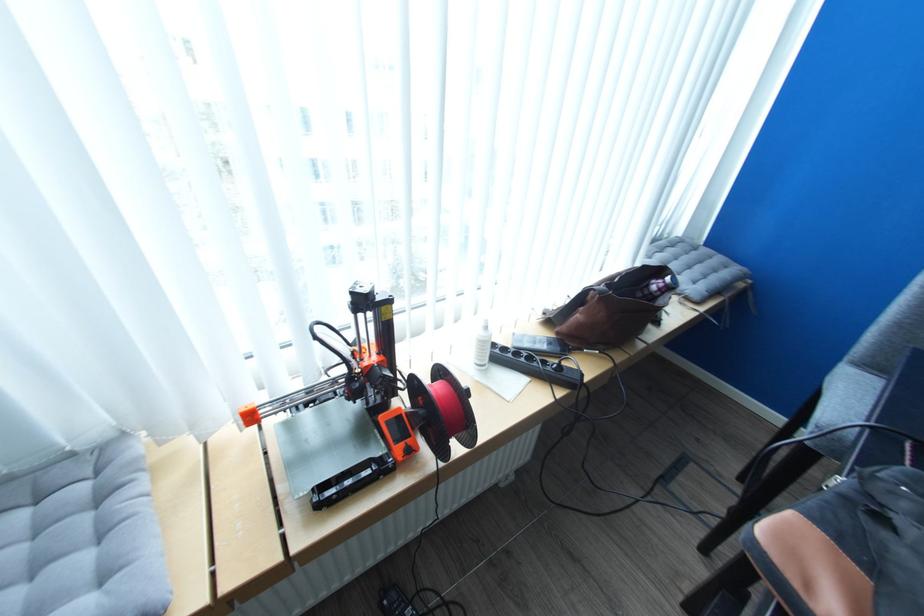
Where is `printer control knob`? The image size is (924, 616). printer control knob is located at coordinates (419, 517).